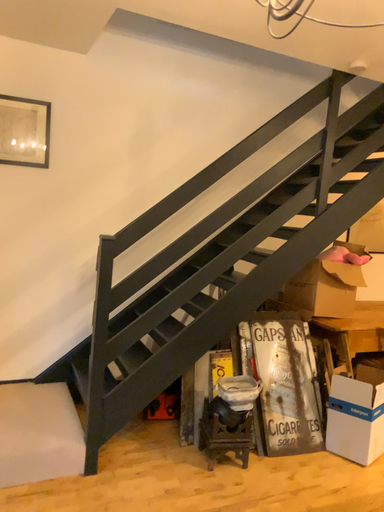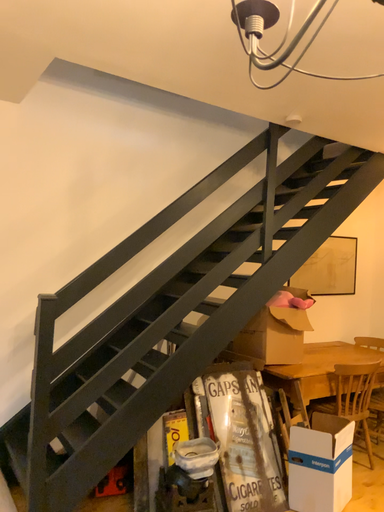
Question: How did the camera likely rotate when shooting the video?

Choices:
 (A) rotated upward
 (B) rotated downward

Answer: (A)